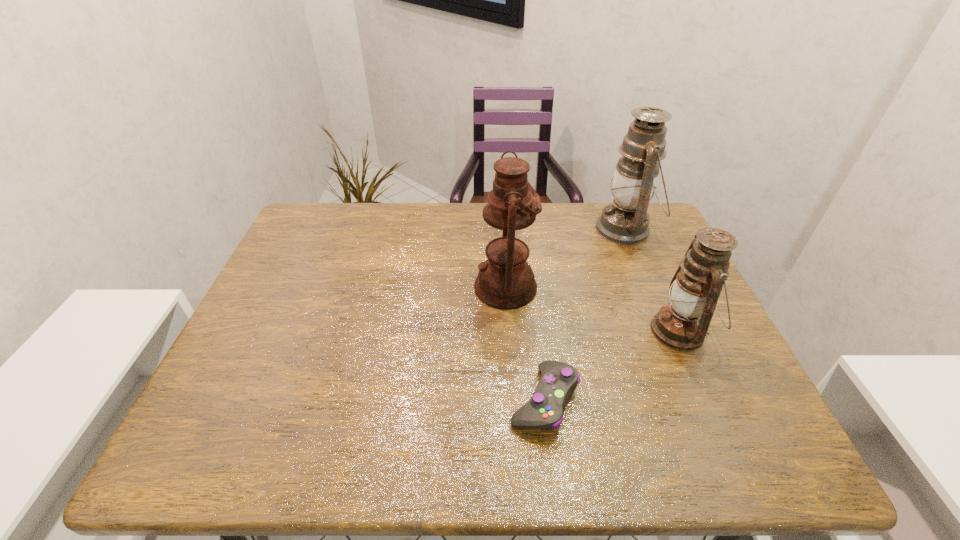
Locate an element on the screen. This screenshot has width=960, height=540. vacant point located between the leftmost lantern and the nearest object is located at coordinates (525, 343).

Where is `empty location between the control and the shortest lantern`? The width and height of the screenshot is (960, 540). empty location between the control and the shortest lantern is located at coordinates (612, 365).

Identify the location of vacant area between the leftmost lantern and the farthest object. The height and width of the screenshot is (540, 960). [x=565, y=258].

This screenshot has height=540, width=960. Find the location of `free spot between the shortest object and the third tallest object`. free spot between the shortest object and the third tallest object is located at coordinates (612, 365).

Identify the location of free point between the leftmost lantern and the farthest object. The width and height of the screenshot is (960, 540). (565, 258).

Identify the location of free space that is in between the nearest object and the shortest lantern. The height and width of the screenshot is (540, 960). (612, 365).

Where is `free space between the control and the leftmost lantern`? free space between the control and the leftmost lantern is located at coordinates click(x=525, y=343).

Select which object is the closest to the leftmost lantern. Please provide its 2D coordinates. Your answer should be formatted as a tuple, i.e. [(x, y)], where the tuple contains the x and y coordinates of a point satisfying the conditions above.

[(544, 411)]

Where is `object that is the second closest one to the farthest object`? The height and width of the screenshot is (540, 960). object that is the second closest one to the farthest object is located at coordinates (505, 280).

Locate an element on the screen. lantern object that ranks as the second closest to the farthest lantern is located at coordinates (505, 280).